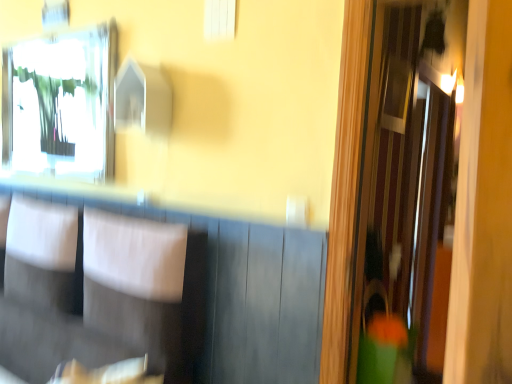
Measure the distance between white fabric armchair at center and camera.

The distance of white fabric armchair at center from camera is 1.51 meters.

What are the coordinates of `white fabric armchair at center` in the screenshot? It's located at 110,300.

What do you see at coordinates (110, 300) in the screenshot? I see `white fabric armchair at center` at bounding box center [110, 300].

Where is `clear glass mirror at upper left`? clear glass mirror at upper left is located at coordinates (61, 103).

What do you see at coordinates (61, 103) in the screenshot? The image size is (512, 384). I see `clear glass mirror at upper left` at bounding box center [61, 103].

Locate an element on the screen. white fabric armchair at center is located at coordinates pos(110,300).

Which object is positioned more to the left, clear glass mirror at upper left or white fabric armchair at center?

clear glass mirror at upper left.

Relative to white fabric armchair at center, is clear glass mirror at upper left in front or behind?

clear glass mirror at upper left is behind white fabric armchair at center.

Between point (84, 153) and point (139, 239), which one is positioned behind?

Point (84, 153)

From the image's perspective, which is below, clear glass mirror at upper left or white fabric armchair at center?

white fabric armchair at center is shown below in the image.

From the picture: From a real-world perspective, between clear glass mirror at upper left and white fabric armchair at center, who is vertically lower?

white fabric armchair at center.

Is clear glass mirror at upper left wider than white fabric armchair at center?

Incorrect, the width of clear glass mirror at upper left does not surpass that of white fabric armchair at center.

Is clear glass mirror at upper left taller than white fabric armchair at center?

Indeed, clear glass mirror at upper left has a greater height compared to white fabric armchair at center.

Between clear glass mirror at upper left and white fabric armchair at center, which one has smaller size?

clear glass mirror at upper left is smaller.

From the picture: Do you think clear glass mirror at upper left is within white fabric armchair at center, or outside of it?

The correct answer is: outside.

Is clear glass mirror at upper left not close to white fabric armchair at center?

clear glass mirror at upper left is actually quite close to white fabric armchair at center.

Based on the photo, is clear glass mirror at upper left positioned with its back to white fabric armchair at center?

No.

What's the angular difference between clear glass mirror at upper left and white fabric armchair at center's facing directions?

0.185 degrees separate the facing orientations of clear glass mirror at upper left and white fabric armchair at center.

This screenshot has width=512, height=384. What are the coordinates of `armchair lying on the right of clear glass mirror at upper left` in the screenshot? It's located at (110, 300).

Does white fabric armchair at center appear on the left side of clear glass mirror at upper left?

Incorrect, white fabric armchair at center is not on the left side of clear glass mirror at upper left.

Does white fabric armchair at center lie behind clear glass mirror at upper left?

No, the depth of white fabric armchair at center is less than that of clear glass mirror at upper left.

Based on the photo, which point is more distant from viewer, (18, 234) or (69, 79)?

The point (69, 79) is more distant.

From the image's perspective, is white fabric armchair at center above or below clear glass mirror at upper left?

Clearly, from the image's perspective, white fabric armchair at center is below clear glass mirror at upper left.

Based on the photo, from a real-world perspective, is white fabric armchair at center beneath clear glass mirror at upper left?

Indeed, from a real-world perspective, white fabric armchair at center is positioned beneath clear glass mirror at upper left.

Does white fabric armchair at center have a lesser width compared to clear glass mirror at upper left?

No.

Considering the relative sizes of white fabric armchair at center and clear glass mirror at upper left in the image provided, is white fabric armchair at center taller than clear glass mirror at upper left?

In fact, white fabric armchair at center may be shorter than clear glass mirror at upper left.

Does white fabric armchair at center have a smaller size compared to clear glass mirror at upper left?

Actually, white fabric armchair at center might be larger than clear glass mirror at upper left.

Can we say white fabric armchair at center lies outside clear glass mirror at upper left?

Yes, white fabric armchair at center is not within clear glass mirror at upper left.

Would you consider white fabric armchair at center to be distant from clear glass mirror at upper left?

No, white fabric armchair at center is not far away from clear glass mirror at upper left.

Is white fabric armchair at center aimed at clear glass mirror at upper left?

No, white fabric armchair at center is not oriented towards clear glass mirror at upper left.

How different are the orientations of white fabric armchair at center and clear glass mirror at upper left in degrees?

They differ by 0.185 degrees in their facing directions.

Identify the location of mirror on the left of white fabric armchair at center. The width and height of the screenshot is (512, 384). (61, 103).

Locate an element on the screen. This screenshot has width=512, height=384. mirror that is behind the white fabric armchair at center is located at coordinates (61, 103).

I want to click on mirror above the white fabric armchair at center (from a real-world perspective), so click(61, 103).